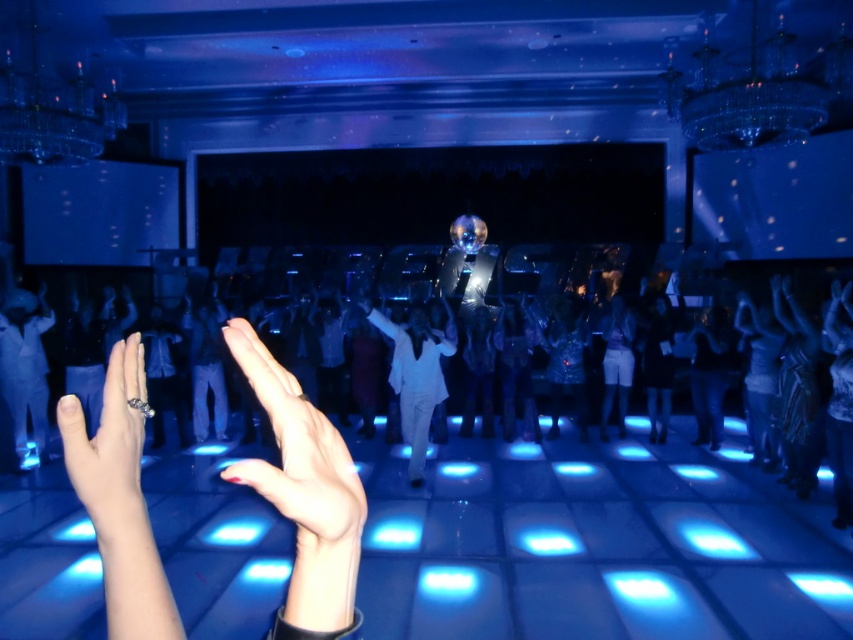
In the image of the party scene with blue lighting, you see nail polish at center and silver metallic ring at lower left. Which object is positioned to the right of the other?

The nail polish at center is to the right of the silver metallic ring at lower left.

You are at the party and want to know which of the two points, point (256,372) or point (125,513), is nearer to you. Can you determine this based on the scene?

Point (256,372) is closer to the viewer than point (125,513), so yes, you can determine that point (256,372) is nearer to you.